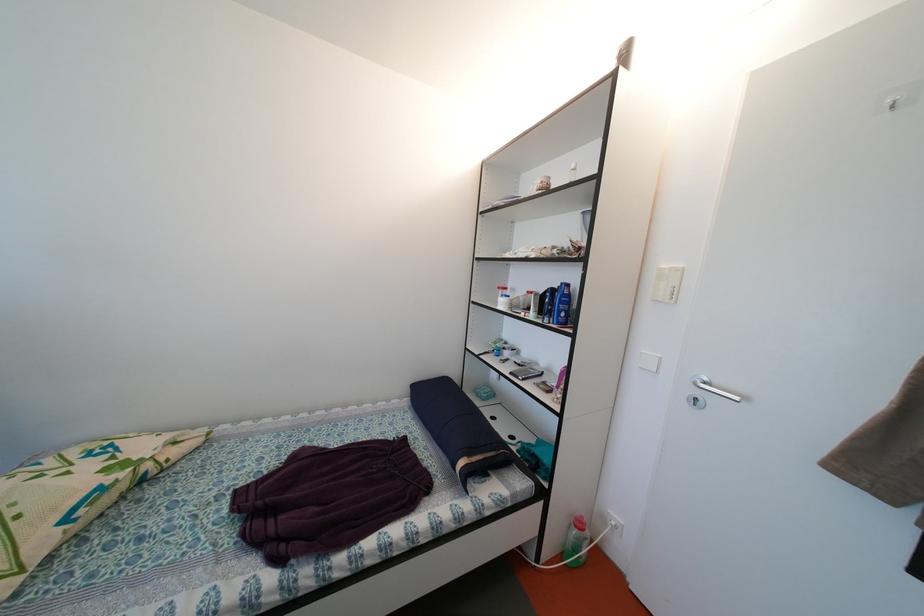
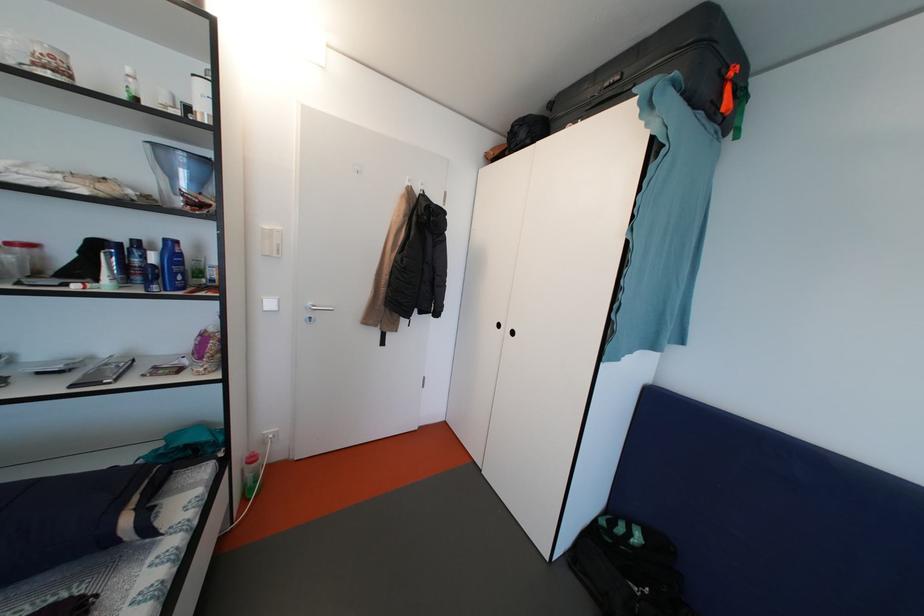
The images are taken continuously from a first-person perspective. In which direction is your viewpoint rotating?

The camera rotated toward right-down.